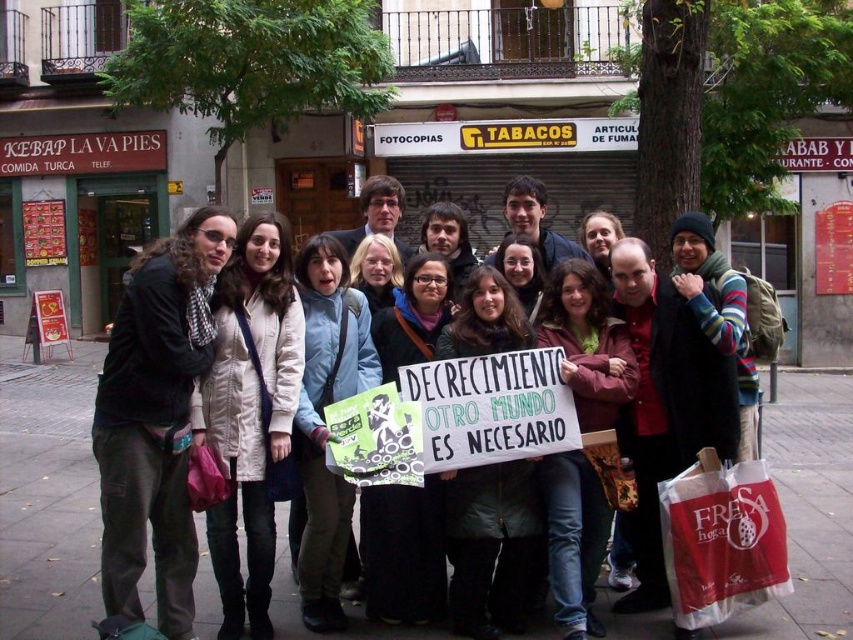
Is matte black jacket at center in front of red plastic bag at lower right?

Yes, it is in front of red plastic bag at lower right.

Identify the location of matte black jacket at center. The width and height of the screenshot is (853, 640). (663, 371).